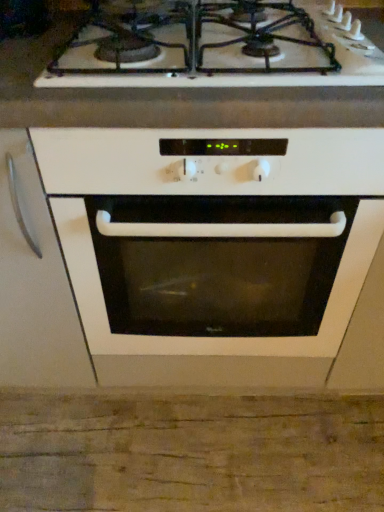
What do you see at coordinates (232, 55) in the screenshot?
I see `white glossy gas stove at upper center` at bounding box center [232, 55].

This screenshot has height=512, width=384. I want to click on white glossy gas stove at upper center, so click(x=232, y=55).

Find the location of a particular element. Image resolution: width=384 pixels, height=512 pixels. white glossy oven at center is located at coordinates (214, 249).

What do you see at coordinates (214, 249) in the screenshot? The image size is (384, 512). I see `white glossy oven at center` at bounding box center [214, 249].

This screenshot has width=384, height=512. In order to click on white glossy gas stove at upper center in this screenshot , I will do `click(232, 55)`.

Consider the image. Does white glossy oven at center appear on the right side of white glossy gas stove at upper center?

Indeed, white glossy oven at center is positioned on the right side of white glossy gas stove at upper center.

Is white glossy oven at center in front of or behind white glossy gas stove at upper center in the image?

Clearly, white glossy oven at center is in front of white glossy gas stove at upper center.

Is point (212, 241) closer to camera compared to point (373, 72)?

No, it is behind (373, 72).

From the image's perspective, is white glossy oven at center located above or below white glossy gas stove at upper center?

white glossy oven at center is below white glossy gas stove at upper center.

From a real-world perspective, between white glossy oven at center and white glossy gas stove at upper center, who is vertically higher?

white glossy gas stove at upper center, from a real-world perspective.

Considering the sizes of objects white glossy oven at center and white glossy gas stove at upper center in the image provided, who is thinner, white glossy oven at center or white glossy gas stove at upper center?

white glossy gas stove at upper center.

Considering the sizes of white glossy oven at center and white glossy gas stove at upper center in the image, is white glossy oven at center taller or shorter than white glossy gas stove at upper center?

Clearly, white glossy oven at center is taller compared to white glossy gas stove at upper center.

From the picture: Based on their sizes in the image, would you say white glossy oven at center is bigger or smaller than white glossy gas stove at upper center?

white glossy oven at center is bigger than white glossy gas stove at upper center.

Is white glossy gas stove at upper center located within white glossy oven at center?

No.

Is there a large distance between white glossy oven at center and white glossy gas stove at upper center?

That's not correct — white glossy oven at center is a little close to white glossy gas stove at upper center.

Is white glossy oven at center facing towards white glossy gas stove at upper center?

No, white glossy oven at center does not turn towards white glossy gas stove at upper center.

Looking at this image, can you tell me how much white glossy oven at center and white glossy gas stove at upper center differ in facing direction?

white glossy oven at center and white glossy gas stove at upper center are facing 0.323 degrees away from each other.

Identify the location of oven below the white glossy gas stove at upper center (from a real-world perspective). This screenshot has width=384, height=512. (214, 249).

Which object is positioned more to the left, white glossy gas stove at upper center or white glossy oven at center?

From the viewer's perspective, white glossy gas stove at upper center appears more on the left side.

Is white glossy gas stove at upper center in front of or behind white glossy oven at center in the image?

white glossy gas stove at upper center is behind white glossy oven at center.

Which is in front, point (101, 39) or point (147, 159)?

The point (147, 159) is closer to the camera.

From the image's perspective, is white glossy gas stove at upper center positioned above or below white glossy oven at center?

Clearly, from the image's perspective, white glossy gas stove at upper center is above white glossy oven at center.

From a real-world perspective, is white glossy gas stove at upper center physically located above or below white glossy oven at center?

white glossy gas stove at upper center is situated higher than white glossy oven at center in the real world.

Considering the sizes of objects white glossy gas stove at upper center and white glossy oven at center in the image provided, who is wider, white glossy gas stove at upper center or white glossy oven at center?

white glossy oven at center is wider.

Who is taller, white glossy gas stove at upper center or white glossy oven at center?

With more height is white glossy oven at center.

Considering the sizes of white glossy gas stove at upper center and white glossy oven at center in the image, is white glossy gas stove at upper center bigger or smaller than white glossy oven at center?

white glossy gas stove at upper center is smaller than white glossy oven at center.

Choose the correct answer: Is white glossy gas stove at upper center inside white glossy oven at center or outside it?

The correct answer is: outside.

Is white glossy gas stove at upper center next to white glossy oven at center and touching it?

No, white glossy gas stove at upper center is not with white glossy oven at center.

Is white glossy gas stove at upper center turned away from white glossy oven at center?

That's not correct — white glossy gas stove at upper center is not looking away from white glossy oven at center.

How many degrees apart are the facing directions of white glossy gas stove at upper center and white glossy oven at center?

white glossy gas stove at upper center and white glossy oven at center are facing 0.323 degrees away from each other.

Measure the distance from white glossy gas stove at upper center to white glossy oven at center.

A distance of 12.56 inches exists between white glossy gas stove at upper center and white glossy oven at center.

Where is `oven in front of the white glossy gas stove at upper center`? The height and width of the screenshot is (512, 384). oven in front of the white glossy gas stove at upper center is located at coordinates (214, 249).

You are a GUI agent. You are given a task and a screenshot of the screen. Output one action in this format:
    pyautogui.click(x=<x>, y=<y>)
    Task: Click on the gas stove lying behind the white glossy oven at center
    The width and height of the screenshot is (384, 512).
    Given the screenshot: What is the action you would take?
    pyautogui.click(x=232, y=55)

The image size is (384, 512). What are the coordinates of `gas stove above the white glossy oven at center (from a real-world perspective)` in the screenshot? It's located at (232, 55).